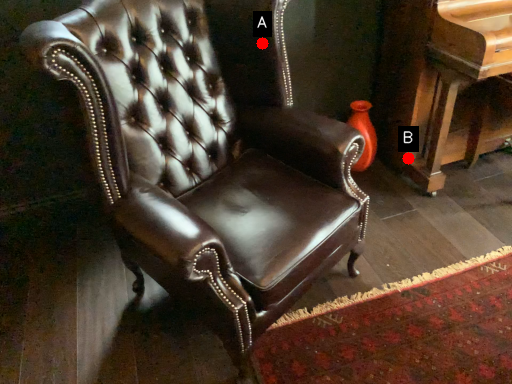
Question: Two points are circled on the image, labeled by A and B beside each circle. Which point is closer to the camera?

Choices:
 (A) A is closer
 (B) B is closer

Answer: (A)